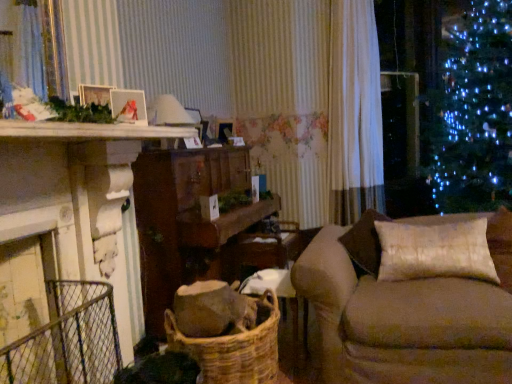
Question: From the image's perspective, is white wooden mantle at upper left located above or below woven brown basket at lower center?

Choices:
 (A) below
 (B) above

Answer: (B)

Question: Is white wooden mantle at upper left spatially inside woven brown basket at lower center, or outside of it?

Choices:
 (A) outside
 (B) inside

Answer: (A)

Question: Considering the real-world distances, which object is closest to the wooden table at center?

Choices:
 (A) woven brown basket at lower center
 (B) white wooden mantle at upper left
 (C) satin beige pillow at right
 (D) white sheer curtain at center
 (E) metallic silver frame at upper left

Answer: (A)

Question: Which of these objects is positioned farthest from the satin beige pillow at right?

Choices:
 (A) velvet beige couch at right
 (B) white sheer curtain at center
 (C) metallic silver frame at upper left
 (D) white wooden mantle at upper left
 (E) woven brown basket at lower center

Answer: (B)